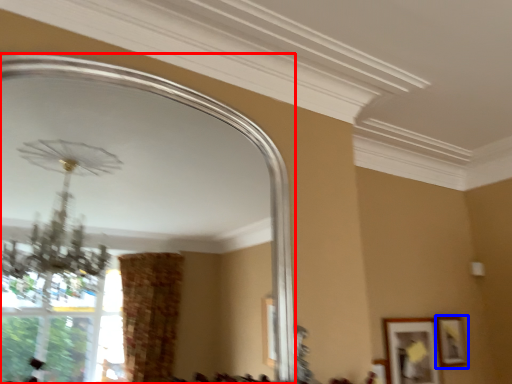
Question: Which point is closer to the camera, mirror (highlighted by a red box) or picture frame (highlighted by a blue box)?

Choices:
 (A) mirror
 (B) picture frame

Answer: (A)